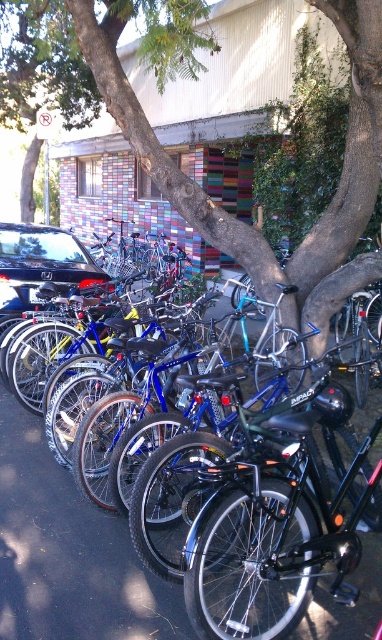
Is black rubber pavement at center positioned in front of glossy black car at left?

Yes, it is.

Which is in front, point (370, 579) or point (17, 289)?

Point (370, 579)

Is point (85, 572) in front of point (0, 240)?

That is True.

Image resolution: width=382 pixels, height=640 pixels. I want to click on black rubber pavement at center, so click(69, 554).

Is smooth bark tree at center bigger than black rubber pavement at center?

Yes.

Who is more distant from viewer, (200, 198) or (129, 612)?

Point (200, 198)

Find the location of a particular element. smooth bark tree at center is located at coordinates (194, 180).

At what (x,y) coordinates should I click in order to perform the action: click on smooth bark tree at center. Please return your answer as a coordinate pair (x, y). The width and height of the screenshot is (382, 640). Looking at the image, I should click on (194, 180).

Can you confirm if smooth bark tree at center is taller than glossy black car at left?

Yes.

Does point (87, 115) come behind point (92, 282)?

Yes, point (87, 115) is farther from viewer.

Where is `smooth bark tree at center`? The image size is (382, 640). smooth bark tree at center is located at coordinates (194, 180).